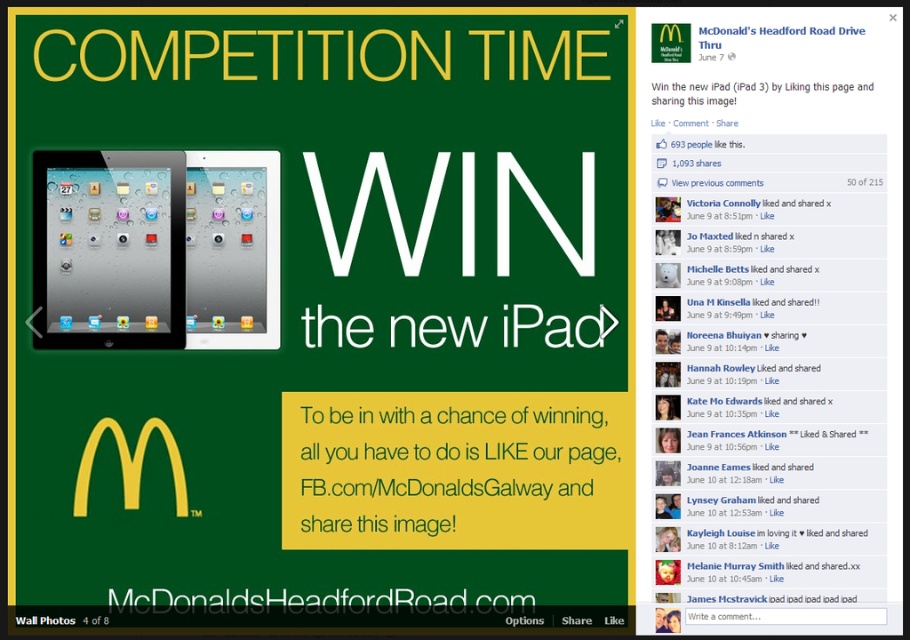
Who is shorter, green paper at center or white paper at upper center?

Standing shorter between the two is white paper at upper center.

Is green paper at center to the left of white paper at upper center from the viewer's perspective?

Yes, green paper at center is to the left of white paper at upper center.

Between point (437, 529) and point (757, 81), which one is positioned behind?

The point (437, 529) is behind.

Locate an element on the screen. Image resolution: width=910 pixels, height=640 pixels. green paper at center is located at coordinates (455, 470).

Is the position of green paper at center more distant than that of white matte text at center?

No, it is in front of white matte text at center.

Between point (523, 470) and point (339, 346), which one is positioned in front?

Positioned in front is point (523, 470).

Image resolution: width=910 pixels, height=640 pixels. What are the coordinates of `green paper at center` in the screenshot? It's located at (455, 470).

Consider the image. Is satin black tablet at left wider than white paper at upper center?

Incorrect, satin black tablet at left's width does not surpass white paper at upper center's.

Consider the image. Does satin black tablet at left appear on the left side of white paper at upper center?

Indeed, satin black tablet at left is positioned on the left side of white paper at upper center.

I want to click on satin black tablet at left, so click(x=108, y=250).